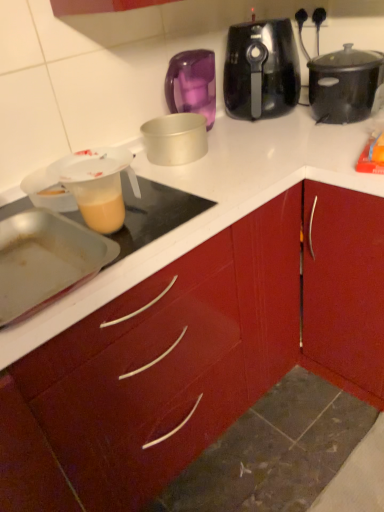
At what (x,y) coordinates should I click in order to perform the action: click on free location in front of black plastic slow cooker at upper center, marked as the second slow cooker in a right-to-left arrangement. Please return your answer as a coordinate pair (x, y). Looking at the image, I should click on (269, 136).